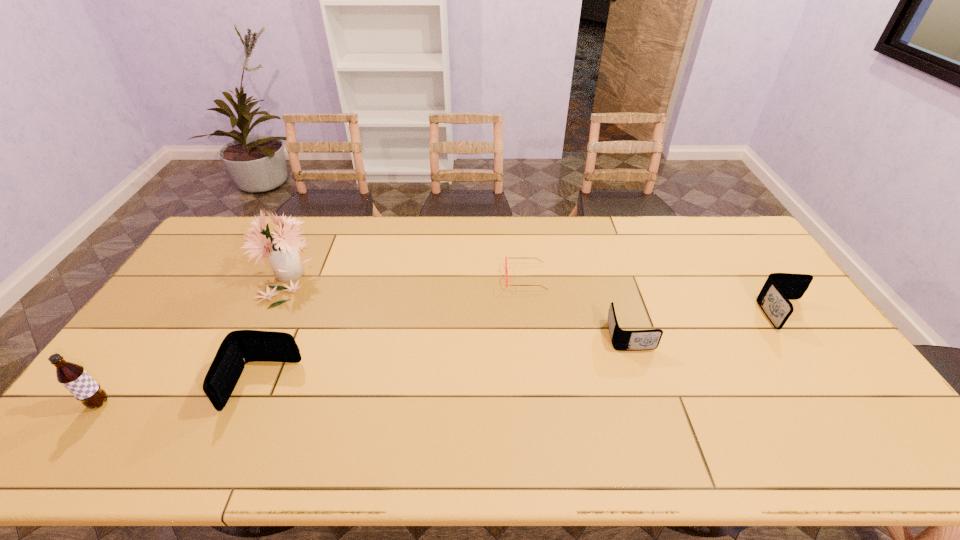
This screenshot has width=960, height=540. In order to click on free point between the leftmost object and the leftmost wallet in this screenshot , I will do `click(181, 394)`.

At what (x,y) coordinates should I click in order to perform the action: click on free spot between the second shortest object and the nearest wallet. Please return your answer as a coordinate pair (x, y). The width and height of the screenshot is (960, 540). Looking at the image, I should click on (446, 361).

The image size is (960, 540). I want to click on unoccupied position between the spectacles and the leftmost wallet, so click(395, 332).

The width and height of the screenshot is (960, 540). In order to click on blank region between the bouquet and the nearest wallet in this screenshot , I will do `click(275, 329)`.

Locate an element on the screen. free space between the leftmost object and the fourth object from left to right is located at coordinates (313, 340).

Identify the location of free point between the second object from right to left and the tallest object. This screenshot has height=540, width=960. (458, 305).

What are the coordinates of `vacant area between the shortest object and the second object from right to left` in the screenshot? It's located at (578, 307).

Where is `vacant area that lies between the fourth object from left to right and the tallest object`? Image resolution: width=960 pixels, height=540 pixels. vacant area that lies between the fourth object from left to right and the tallest object is located at coordinates (406, 275).

You are a GUI agent. You are given a task and a screenshot of the screen. Output one action in this format:
    pyautogui.click(x=<x>, y=<y>)
    Task: Click on the vacant space in between the tallest object and the shortest object
    
    Given the screenshot: What is the action you would take?
    pyautogui.click(x=406, y=275)

The height and width of the screenshot is (540, 960). Identify the location of object that is the fourth closest one to the nearest wallet. (622, 340).